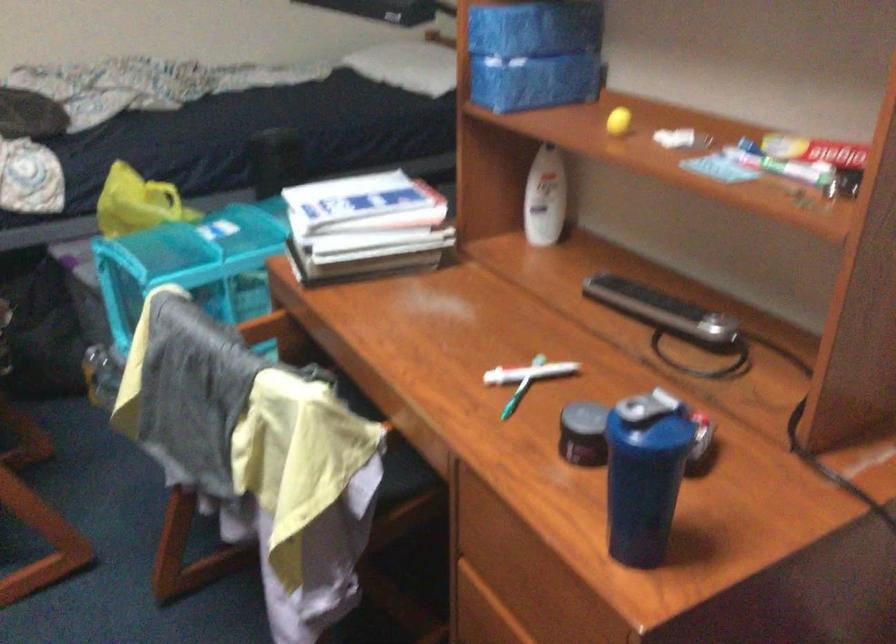
Where would you squeez the toothpaste tube? Please return your answer as a coordinate pair (x, y).

(780, 164)